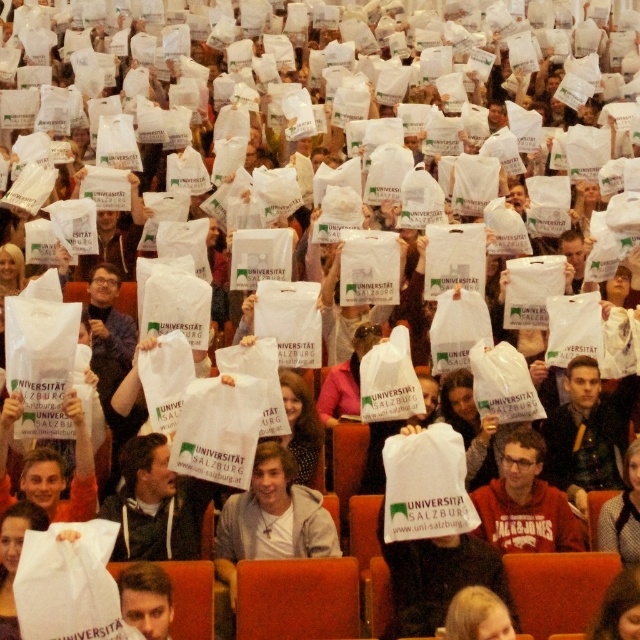
Does smooth white shirt at lower left have a lesser width compared to blonde hair at center?

Correct, smooth white shirt at lower left's width is less than blonde hair at center's.

Is smooth white shirt at lower left taller than blonde hair at center?

Correct, smooth white shirt at lower left is much taller as blonde hair at center.

Who is more distant from viewer, (138, 584) or (483, 628)?

The point (138, 584) is behind.

Locate an element on the screen. This screenshot has width=640, height=640. smooth white shirt at lower left is located at coordinates (145, 598).

Where is `white cotton shirt at center`? The image size is (640, 640). white cotton shirt at center is located at coordinates (273, 516).

Can you confirm if white cotton shirt at center is positioned below blonde hair at center?

Actually, white cotton shirt at center is above blonde hair at center.

Between point (288, 497) and point (492, 616), which one is positioned behind?

Positioned behind is point (288, 497).

Identify the location of white cotton shirt at center. (273, 516).

Between point (529, 428) and point (166, 593), which one is positioned in front?

Positioned in front is point (166, 593).

What are the coordinates of `matte white bag at center` in the screenshot? It's located at (525, 502).

This screenshot has height=640, width=640. I want to click on matte white bag at center, so click(525, 502).